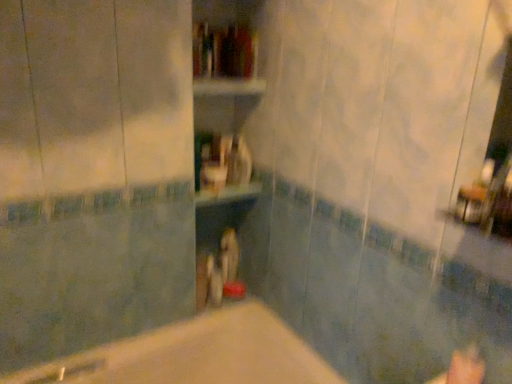
Question: Looking at their shapes, would you say beige matte bathtub at center is wider or thinner than hardcover book at center?

Choices:
 (A) wide
 (B) thin

Answer: (A)

Question: Considering their positions, is beige matte bathtub at center located in front of or behind hardcover book at center?

Choices:
 (A) behind
 (B) front

Answer: (B)

Question: Based on their relative distances, which object is farther from the beige matte bathtub at center?

Choices:
 (A) wooden shelf at center
 (B) hardcover book at center

Answer: (B)

Question: Estimate the real-world distances between objects in this image. Which object is closer to the wooden shelf at center?

Choices:
 (A) beige matte bathtub at center
 (B) hardcover book at center

Answer: (B)